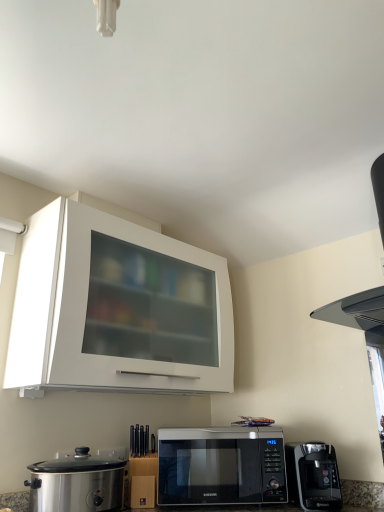
Question: Should I look upward or downward to see black matte vent at upper right?

Choices:
 (A) down
 (B) up

Answer: (B)

Question: Does stainless steel slow cooker at lower left appear on the right side of black plastic coffee maker at lower right?

Choices:
 (A) no
 (B) yes

Answer: (A)

Question: From a real-world perspective, is stainless steel slow cooker at lower left positioned over black plastic coffee maker at lower right based on gravity?

Choices:
 (A) no
 (B) yes

Answer: (A)

Question: Is there a large distance between stainless steel slow cooker at lower left and black plastic coffee maker at lower right?

Choices:
 (A) yes
 (B) no

Answer: (B)

Question: Does stainless steel slow cooker at lower left have a smaller size compared to black plastic coffee maker at lower right?

Choices:
 (A) no
 (B) yes

Answer: (A)

Question: Can we say stainless steel slow cooker at lower left lies outside black plastic coffee maker at lower right?

Choices:
 (A) no
 (B) yes

Answer: (B)

Question: From a real-world perspective, is stainless steel slow cooker at lower left under black plastic coffee maker at lower right?

Choices:
 (A) yes
 (B) no

Answer: (A)

Question: Is black plastic coffee maker at lower right to the right of stainless steel slow cooker at lower left from the viewer's perspective?

Choices:
 (A) yes
 (B) no

Answer: (A)

Question: Considering the relative sizes of black plastic coffee maker at lower right and stainless steel slow cooker at lower left in the image provided, is black plastic coffee maker at lower right bigger than stainless steel slow cooker at lower left?

Choices:
 (A) yes
 (B) no

Answer: (B)

Question: Is black plastic coffee maker at lower right not near stainless steel slow cooker at lower left?

Choices:
 (A) no
 (B) yes

Answer: (A)

Question: Considering the relative sizes of black plastic coffee maker at lower right and stainless steel slow cooker at lower left in the image provided, is black plastic coffee maker at lower right shorter than stainless steel slow cooker at lower left?

Choices:
 (A) yes
 (B) no

Answer: (A)

Question: Is black plastic coffee maker at lower right further to camera compared to stainless steel slow cooker at lower left?

Choices:
 (A) no
 (B) yes

Answer: (B)

Question: From the image's perspective, does black plastic coffee maker at lower right appear lower than stainless steel slow cooker at lower left?

Choices:
 (A) no
 (B) yes

Answer: (B)

Question: From a real-world perspective, is black matte vent at upper right located beneath black glossy microwave at lower center?

Choices:
 (A) no
 (B) yes

Answer: (A)